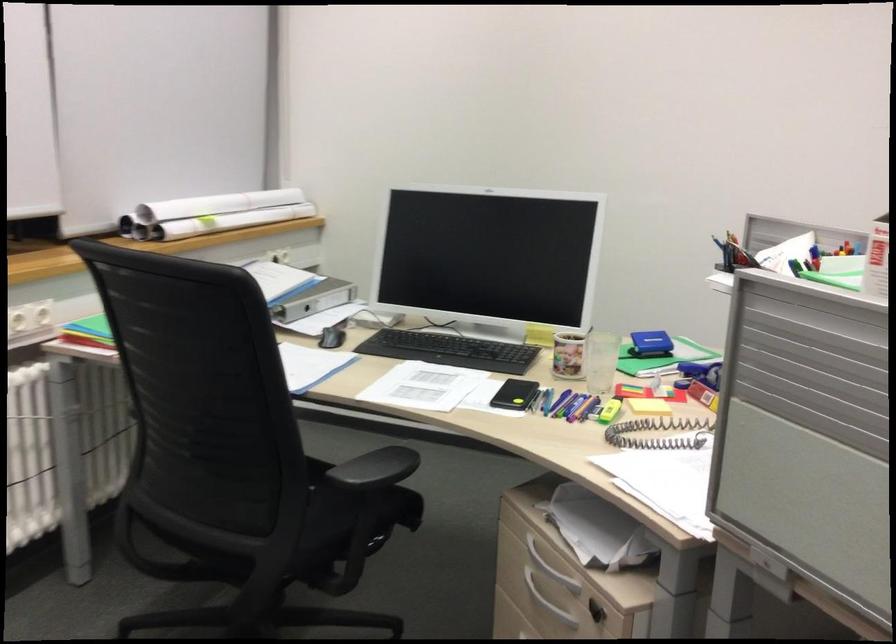
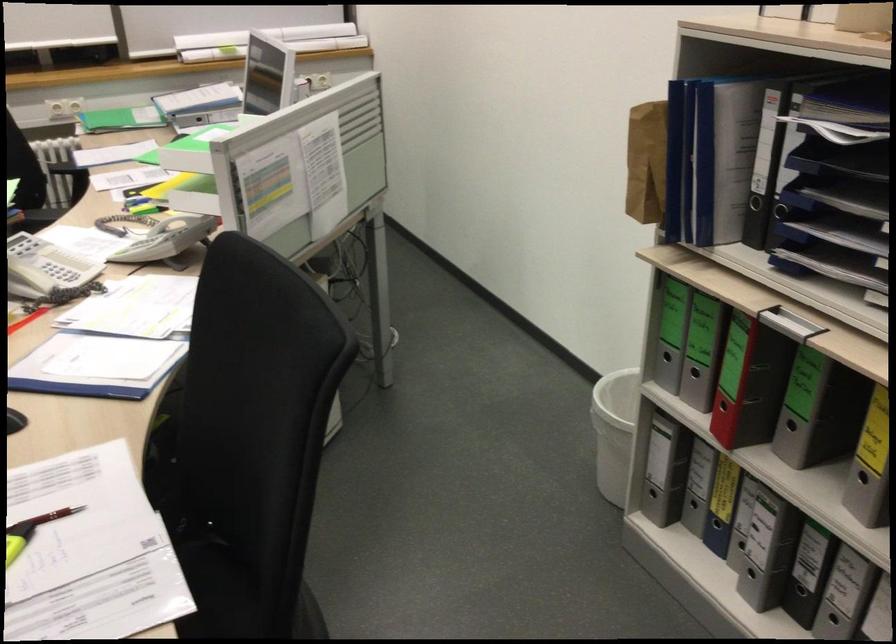
Where in the second image is the point corresponding to point 471,192 from the first image?

(268, 41)